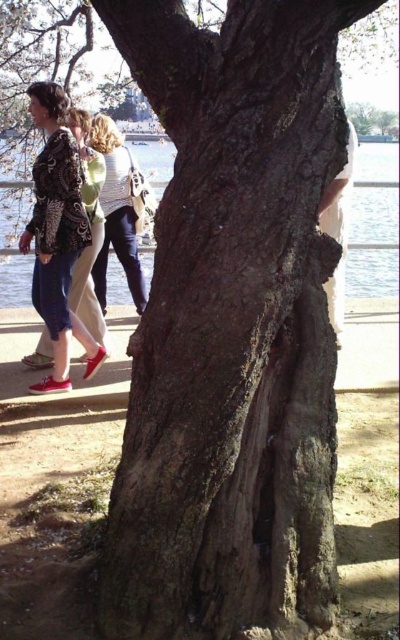
Question: Among these points, which one is nearest to the camera?

Choices:
 (A) (78, 134)
 (B) (172, 56)
 (C) (374, 195)
 (D) (116, 198)

Answer: (B)

Question: Which object appears farthest from the camera in this image?

Choices:
 (A) rough bark tree trunk at center
 (B) matte white sweater at upper left
 (C) clear water at center
 (D) matte black jacket at left

Answer: (C)

Question: Considering the real-world distances, which object is closest to the clear water at center?

Choices:
 (A) matte black jacket at left
 (B) rough bark tree trunk at center

Answer: (A)

Question: Does rough bark tree trunk at center have a lesser width compared to matte white sweater at upper left?

Choices:
 (A) no
 (B) yes

Answer: (A)

Question: Is rough bark tree trunk at center to the right of clear water at center from the viewer's perspective?

Choices:
 (A) yes
 (B) no

Answer: (B)

Question: Is rough bark tree trunk at center above clear water at center?

Choices:
 (A) yes
 (B) no

Answer: (B)